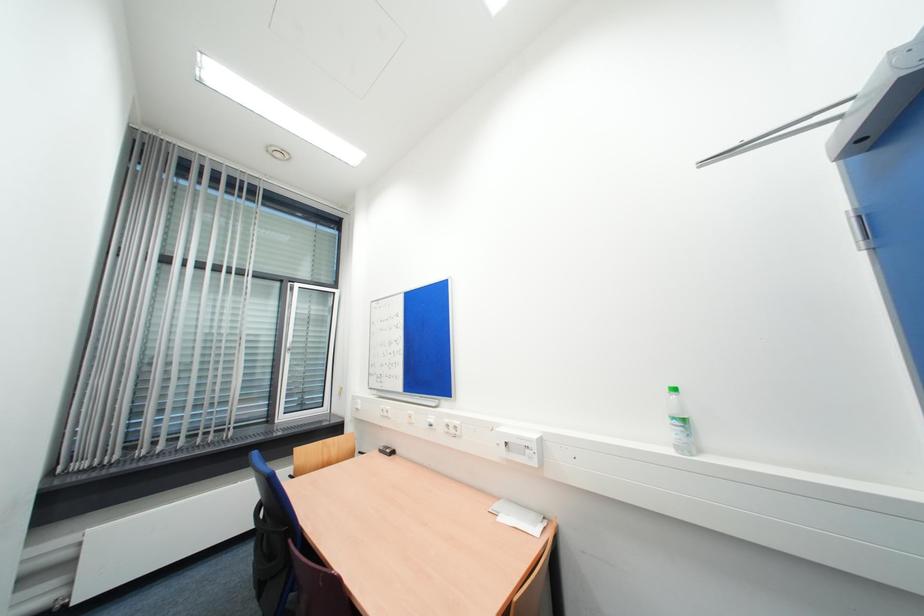
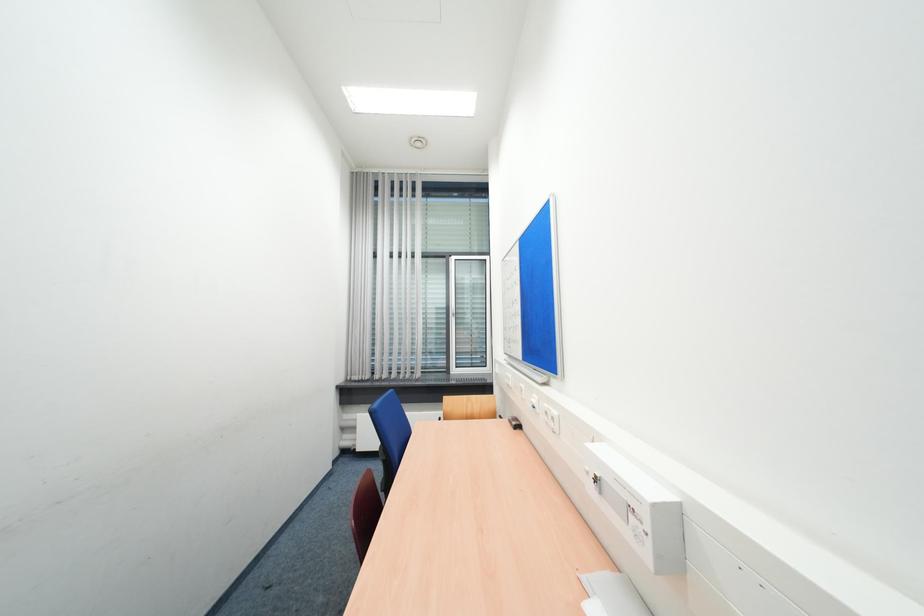
Question: The camera is either moving clockwise (left) or counter-clockwise (right) around the object. The first image is from the beginning of the video and the second image is from the end. Is the camera moving left or right when shooting the video?

Choices:
 (A) Left
 (B) Right

Answer: (B)